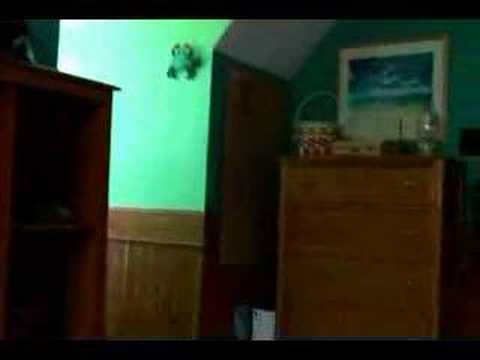
This screenshot has width=480, height=360. I want to click on painted walls, so click(184, 165), click(256, 41), click(398, 29).